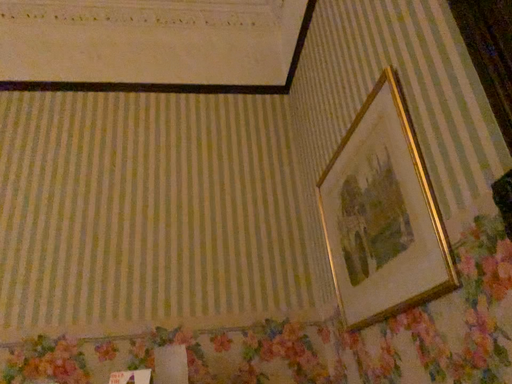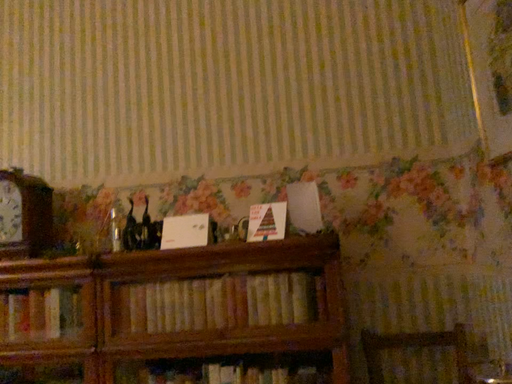
Question: How did the camera likely rotate when shooting the video?

Choices:
 (A) rotated right
 (B) rotated left

Answer: (B)